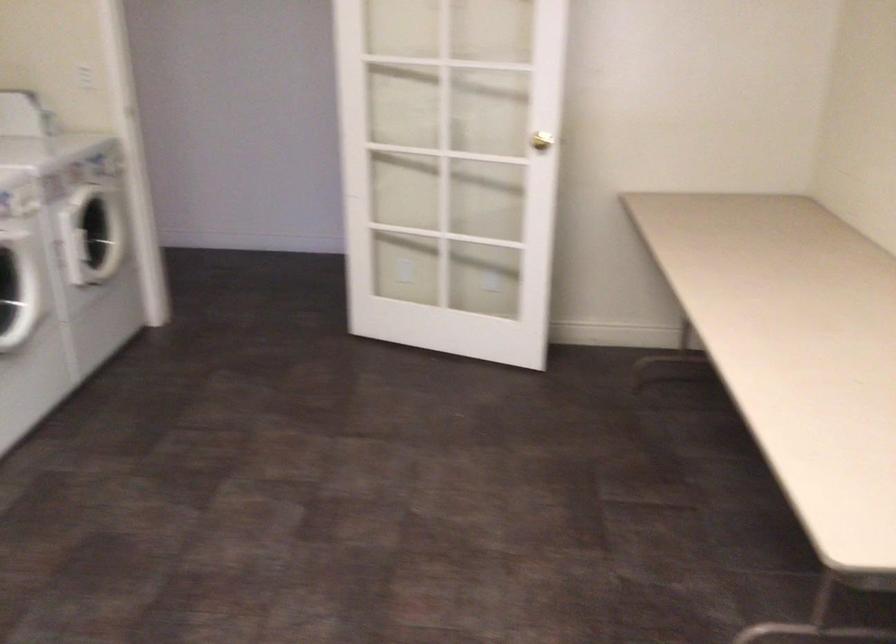
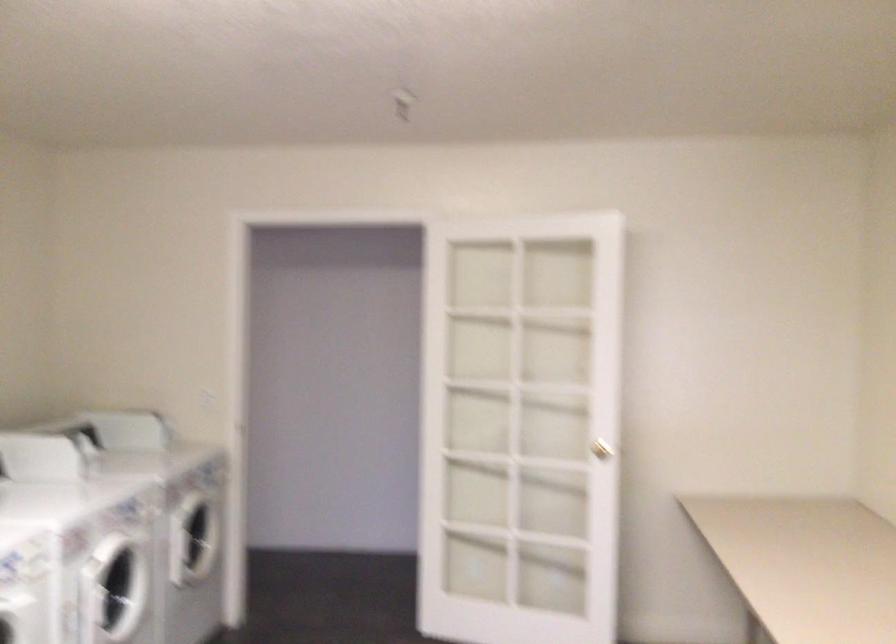
Question: Based on the continuous images, in which direction is the camera rotating? Reply with the corresponding letter.

Choices:
 (A) Left
 (B) Right
 (C) Up
 (D) Down

Answer: (C)